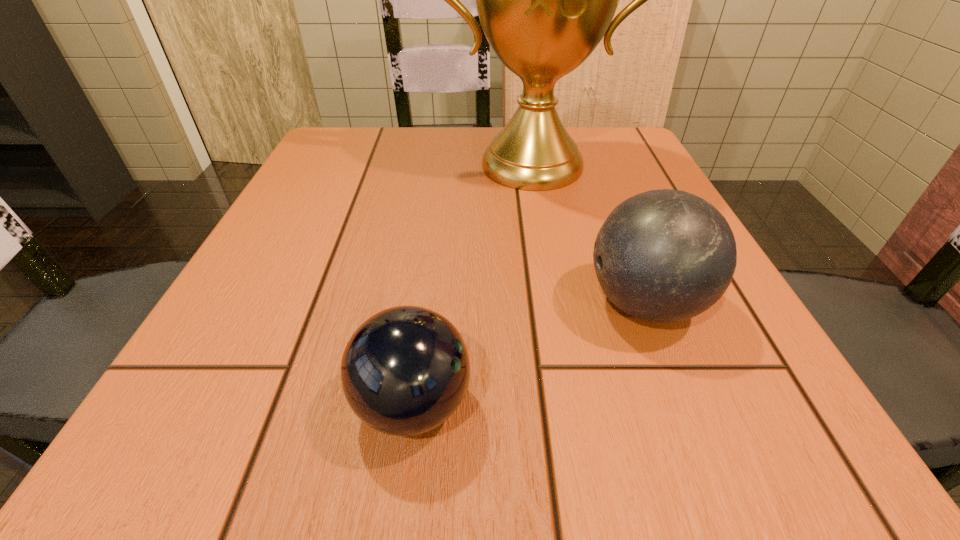
Where is `vacant space that's between the left bowling ball and the farthest object`? vacant space that's between the left bowling ball and the farthest object is located at coordinates (472, 285).

You are a GUI agent. You are given a task and a screenshot of the screen. Output one action in this format:
    pyautogui.click(x=<x>, y=<y>)
    Task: Click on the free spot between the trophy cup and the left bowling ball
    The image size is (960, 540).
    Given the screenshot: What is the action you would take?
    pyautogui.click(x=472, y=285)

You are a GUI agent. You are given a task and a screenshot of the screen. Output one action in this format:
    pyautogui.click(x=<x>, y=<y>)
    Task: Click on the vacant area between the nearest object and the right bowling ball
    The height and width of the screenshot is (540, 960).
    Given the screenshot: What is the action you would take?
    pyautogui.click(x=529, y=354)

This screenshot has height=540, width=960. Find the location of `vacant area between the right bowling ball and the left bowling ball`. vacant area between the right bowling ball and the left bowling ball is located at coordinates (529, 354).

Identify which object is the closest to the trophy cup. Please provide its 2D coordinates. Your answer should be formatted as a tuple, i.e. [(x, y)], where the tuple contains the x and y coordinates of a point satisfying the conditions above.

[(665, 255)]

Identify which object is the closest to the farthest object. Please provide its 2D coordinates. Your answer should be formatted as a tuple, i.e. [(x, y)], where the tuple contains the x and y coordinates of a point satisfying the conditions above.

[(665, 255)]

Identify the location of vacant space that satisfies the following two spatial constraints: 1. on the surface of the tallest object with symbols; 2. on the side of the shortest object with the finger holes. click(x=575, y=404).

Image resolution: width=960 pixels, height=540 pixels. In order to click on blank area in the image that satisfies the following two spatial constraints: 1. on the surface of the trophy cup with symbols; 2. on the side of the left bowling ball with the finger holes in this screenshot , I will do `click(575, 404)`.